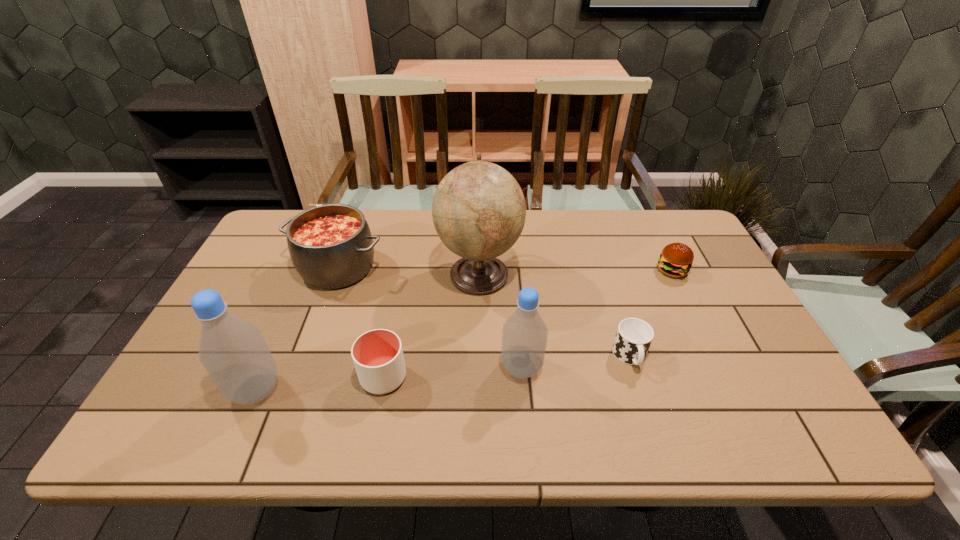
This screenshot has height=540, width=960. What are the coordinates of `bottle present at the left edge` in the screenshot? It's located at (233, 351).

Identify the location of casserole present at the left edge. The image size is (960, 540). (331, 246).

This screenshot has height=540, width=960. I want to click on object situated at the right edge, so click(x=676, y=259).

What are the coordinates of `object at the far left corner` in the screenshot? It's located at (331, 246).

This screenshot has height=540, width=960. What are the coordinates of `object that is at the near left corner` in the screenshot? It's located at (233, 351).

Locate an element on the screen. Image resolution: width=960 pixels, height=540 pixels. vacant space at the far edge of the desktop is located at coordinates (532, 228).

In the image, there is a desktop. Where is `free space at the near edge`? This screenshot has height=540, width=960. free space at the near edge is located at coordinates (354, 397).

Where is `free space at the left edge of the desktop`? This screenshot has height=540, width=960. free space at the left edge of the desktop is located at coordinates click(255, 286).

Identify the location of vacant space at the right edge of the desktop. (706, 260).

I want to click on vacant region at the far right corner of the desktop, so click(x=698, y=240).